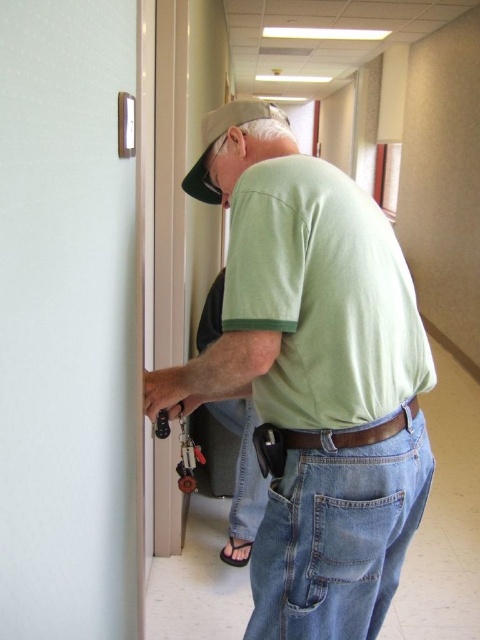
Between green matte shirt at center and khaki fabric baseball cap at center, which one appears on the right side from the viewer's perspective?

green matte shirt at center is more to the right.

Does green matte shirt at center have a smaller size compared to khaki fabric baseball cap at center?

No, green matte shirt at center is not smaller than khaki fabric baseball cap at center.

Is point (326, 596) behind point (264, 116)?

No, (326, 596) is in front of (264, 116).

The image size is (480, 640). I want to click on green matte shirt at center, so click(312, 376).

Between green cotton shirt at center and denim jeans at lower right, which one is positioned higher?

green cotton shirt at center is higher up.

Is point (319, 307) more distant than point (296, 481)?

No, it is in front of (296, 481).

Which is behind, point (310, 195) or point (282, 612)?

The point (282, 612) is behind.

What are the coordinates of `green cotton shirt at center` in the screenshot? It's located at (323, 298).

How far apart are white glossy door at left and denim jeans at lower right?

The distance of white glossy door at left from denim jeans at lower right is 17.52 inches.

Does white glossy door at left have a smaller size compared to denim jeans at lower right?

Indeed, white glossy door at left has a smaller size compared to denim jeans at lower right.

The height and width of the screenshot is (640, 480). In order to click on white glossy door at left in this screenshot , I will do `click(67, 323)`.

At what (x,y) coordinates should I click in order to perform the action: click on white glossy door at left. Please return your answer as a coordinate pair (x, y). This screenshot has width=480, height=640. Looking at the image, I should click on (67, 323).